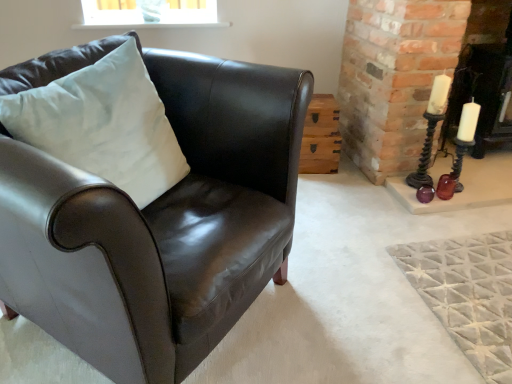
I want to click on free spot to the right of shiny brown leather armchair at left, so click(373, 280).